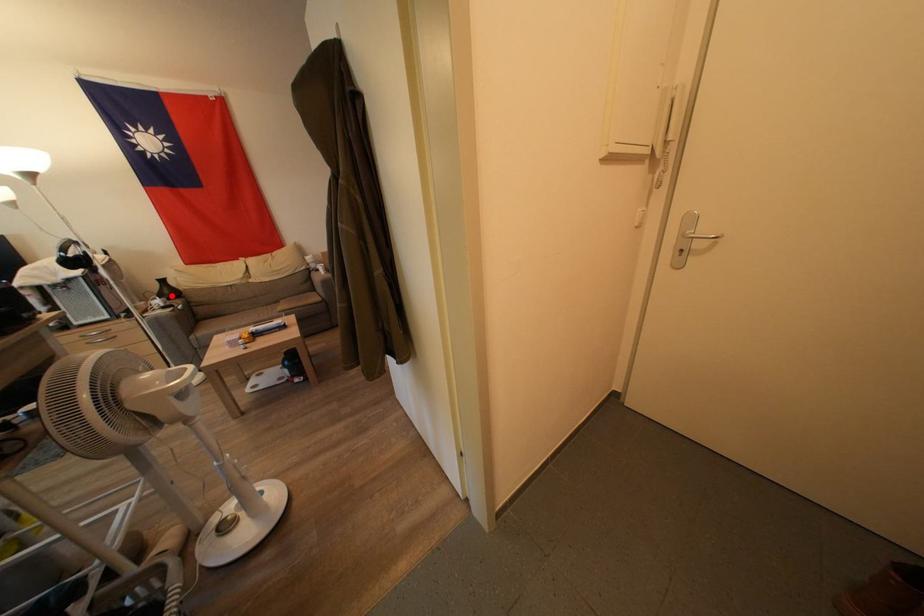
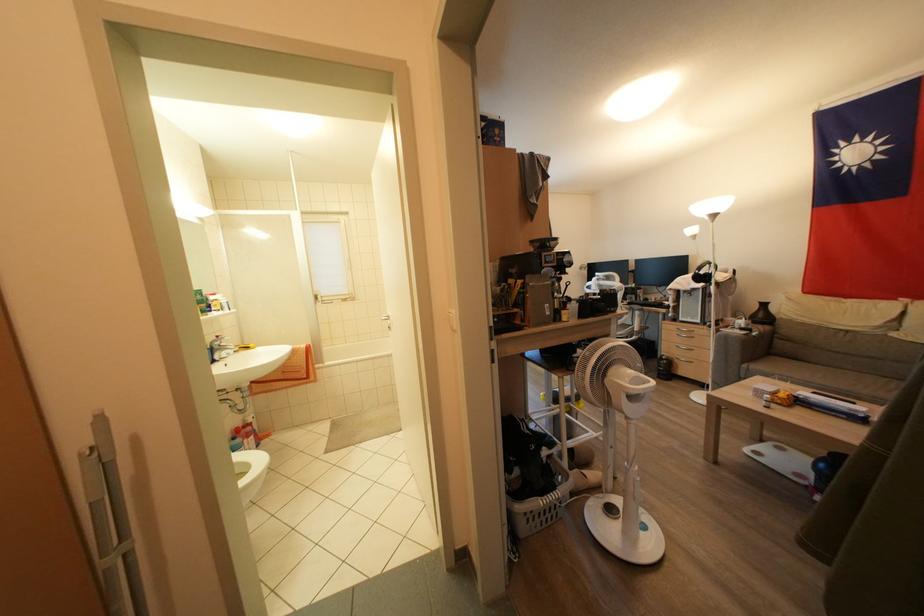
In the second image, find the point that corresponds to the highlighted location in the first image.

(766, 320)